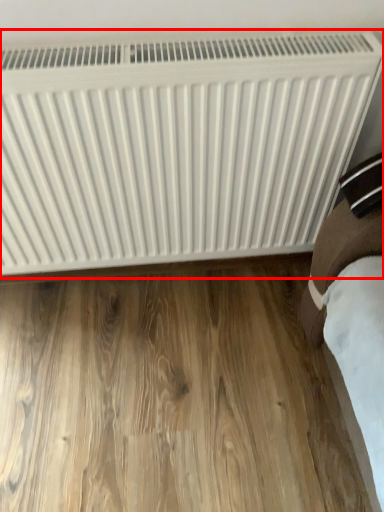
Question: From the image's perspective, where is radiator (annotated by the red box) located in relation to hardwood in the image?

Choices:
 (A) above
 (B) below

Answer: (A)